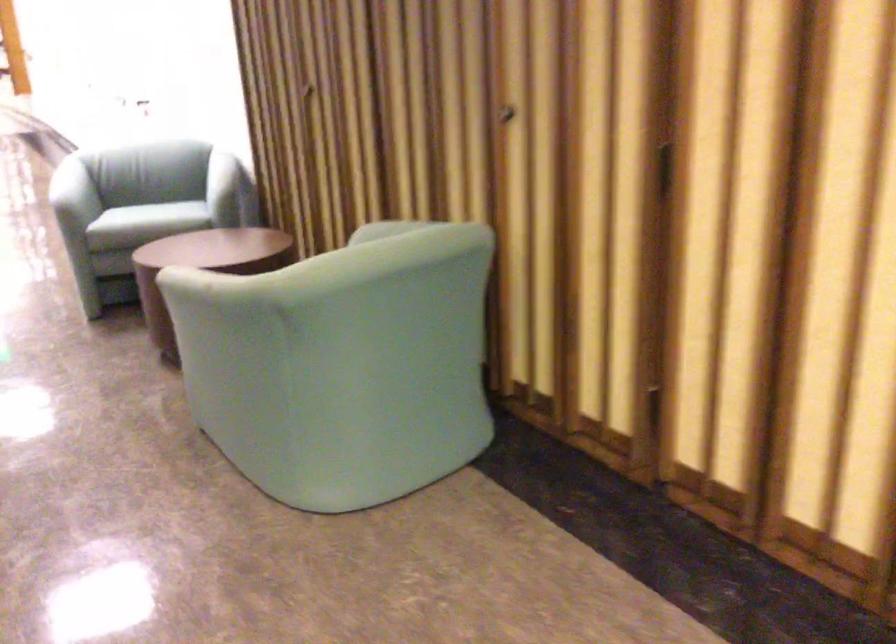
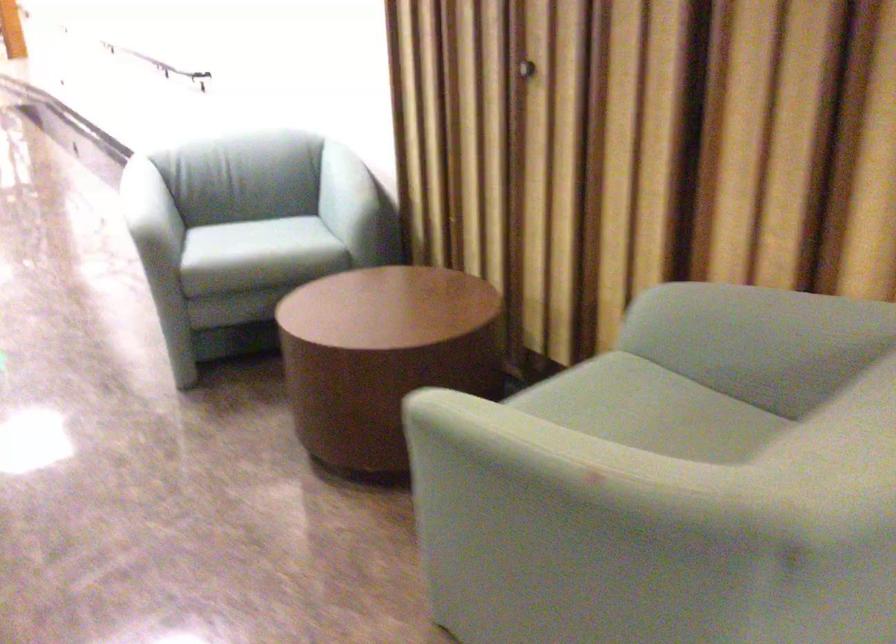
In the second image, find the point that corresponds to point (202, 166) in the first image.

(346, 191)